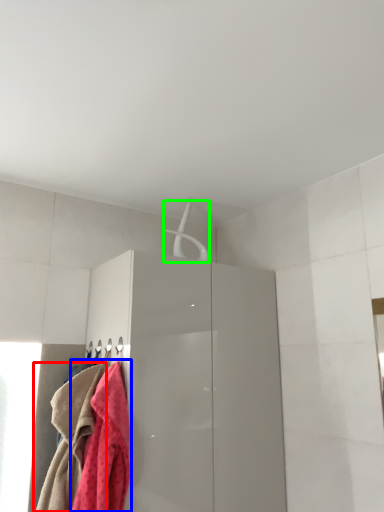
Question: Considering the real-world distances, which object is farthest from towel (highlighted by a red box)? towel (highlighted by a blue box) or hanger (highlighted by a green box)?

Choices:
 (A) towel
 (B) hanger

Answer: (B)